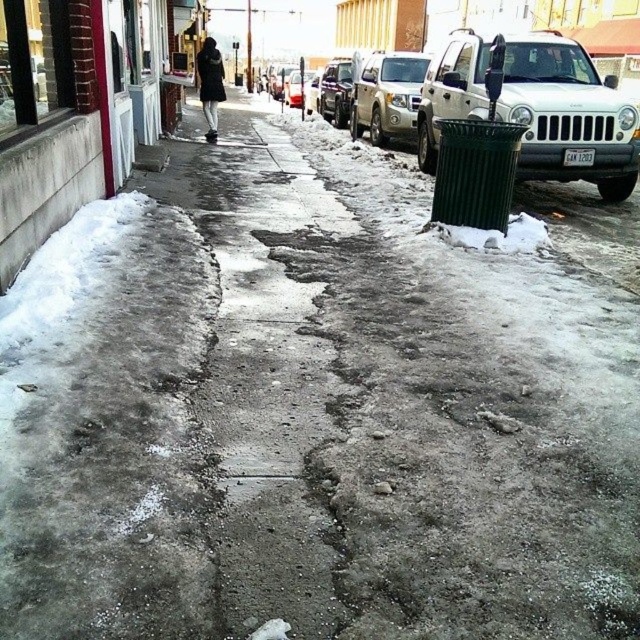
Question: Can you confirm if silver metallic jeep at right is wider than satin silver jeep at center?

Choices:
 (A) no
 (B) yes

Answer: (B)

Question: Which point appears farthest from the camera in this image?

Choices:
 (A) (422, 65)
 (B) (570, 104)

Answer: (A)

Question: Does satin silver jeep at center appear on the left side of metallic silver suv at center?

Choices:
 (A) yes
 (B) no

Answer: (B)

Question: Among these points, which one is nearest to the camera?

Choices:
 (A) (344, 102)
 (B) (525, 51)
 (C) (420, 65)
 (D) (310, 72)

Answer: (B)

Question: Is silver metallic jeep at right to the right of satin silver suv at center from the viewer's perspective?

Choices:
 (A) yes
 (B) no

Answer: (A)

Question: Which of these objects is positioned closest to the satin silver suv at center?

Choices:
 (A) metallic silver suv at center
 (B) silver metallic jeep at right
 (C) satin silver jeep at center

Answer: (C)